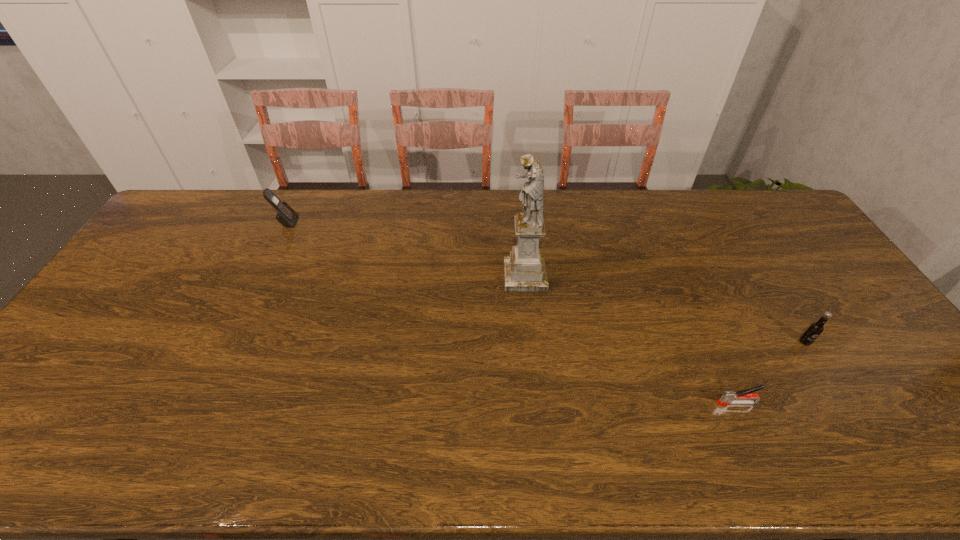
I want to click on free location located 0.170m on the front-facing side of the third object from right to left, so click(448, 276).

At what (x,y) coordinates should I click in order to perform the action: click on vacant space located on the front-facing side of the farthest object. Please return your answer as a coordinate pair (x, y). The width and height of the screenshot is (960, 540). Looking at the image, I should click on (408, 222).

The height and width of the screenshot is (540, 960). In order to click on vacant position located on the label of the root beer in this screenshot , I will do `click(859, 429)`.

Identify the location of free spot located 0.210m on the handle side of the stapler. (631, 403).

Where is `blank space located on the handle side of the stapler`? blank space located on the handle side of the stapler is located at coordinates (677, 403).

At what (x,y) coordinates should I click in order to perform the action: click on vacant space located on the handle side of the stapler. Please return your answer as a coordinate pair (x, y). Looking at the image, I should click on (598, 403).

Locate an element on the screen. object situated at the far edge is located at coordinates (286, 216).

I want to click on free space at the far edge, so click(x=590, y=212).

The height and width of the screenshot is (540, 960). In the image, there is a desktop. In order to click on vacant space at the left edge in this screenshot , I will do `click(63, 420)`.

Image resolution: width=960 pixels, height=540 pixels. What are the coordinates of `free space at the right edge` in the screenshot? It's located at (785, 232).